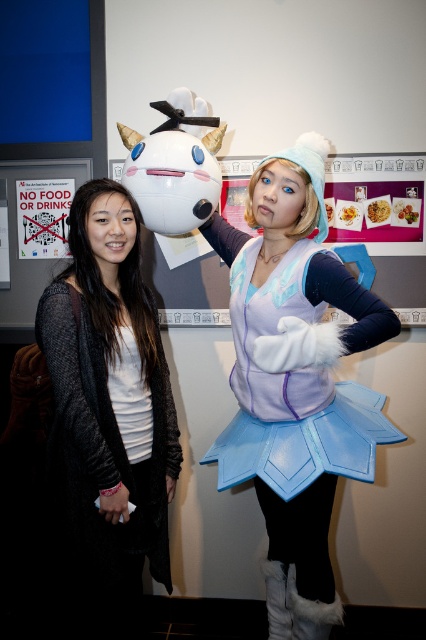
Question: Observing the image, what is the correct spatial positioning of matte purple vest at center in reference to paper posters at center?

Choices:
 (A) above
 (B) below

Answer: (B)

Question: Is matte purple vest at center further to the viewer compared to paper posters at center?

Choices:
 (A) yes
 (B) no

Answer: (B)

Question: Which point appears farthest from the camera in this image?

Choices:
 (A) (230, 266)
 (B) (106, 385)
 (C) (388, 163)

Answer: (C)

Question: Is black knit cardigan at left thinner than matte purple vest at center?

Choices:
 (A) yes
 (B) no

Answer: (A)

Question: Which point is closer to the camera?

Choices:
 (A) black knit cardigan at left
 (B) paper posters at center

Answer: (A)

Question: Based on their relative distances, which object is nearer to the paper posters at center?

Choices:
 (A) matte purple vest at center
 (B) black knit cardigan at left

Answer: (A)